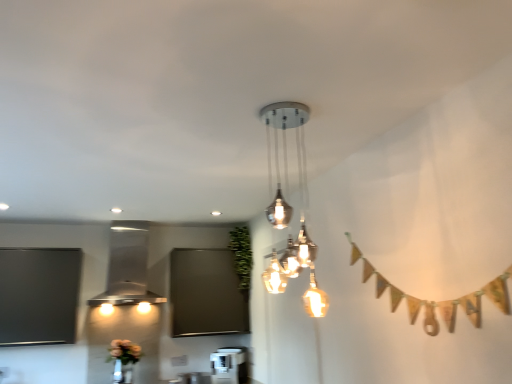
Question: Which direction should I rotate to look at satin silver pendant light at center, the 1th lamp viewed from the right?

Choices:
 (A) right
 (B) left

Answer: (A)

Question: Is matte floral arrangement at lower left positioned before satin silver pendant light at center, marked as the 1th lamp in a front-to-back arrangement?

Choices:
 (A) yes
 (B) no

Answer: (B)

Question: Does matte floral arrangement at lower left have a lesser width compared to satin silver pendant light at center, which is the second lamp in back-to-front order?

Choices:
 (A) no
 (B) yes

Answer: (B)

Question: Is matte floral arrangement at lower left at the left side of satin silver pendant light at center, the 1th lamp viewed from the right?

Choices:
 (A) no
 (B) yes

Answer: (B)

Question: Is matte floral arrangement at lower left aimed at satin silver pendant light at center, marked as the 1th lamp in a front-to-back arrangement?

Choices:
 (A) yes
 (B) no

Answer: (A)

Question: Considering the relative sizes of matte floral arrangement at lower left and satin silver pendant light at center, which appears as the 2th lamp when viewed from the left, in the image provided, is matte floral arrangement at lower left smaller than satin silver pendant light at center, which appears as the 2th lamp when viewed from the left,?

Choices:
 (A) yes
 (B) no

Answer: (A)

Question: From the image's perspective, is matte floral arrangement at lower left under satin silver pendant light at center, which is the second lamp in back-to-front order?

Choices:
 (A) yes
 (B) no

Answer: (A)

Question: Is matte floral arrangement at lower left facing towards green leafy plant at center?

Choices:
 (A) yes
 (B) no

Answer: (B)

Question: Is green leafy plant at center at the back of matte floral arrangement at lower left?

Choices:
 (A) yes
 (B) no

Answer: (B)

Question: Is matte floral arrangement at lower left shorter than green leafy plant at center?

Choices:
 (A) no
 (B) yes

Answer: (B)

Question: Considering the relative positions of matte floral arrangement at lower left and green leafy plant at center in the image provided, is matte floral arrangement at lower left behind green leafy plant at center?

Choices:
 (A) yes
 (B) no

Answer: (B)

Question: Is matte floral arrangement at lower left to the right of green leafy plant at center from the viewer's perspective?

Choices:
 (A) yes
 (B) no

Answer: (B)

Question: Is matte floral arrangement at lower left wider than green leafy plant at center?

Choices:
 (A) yes
 (B) no

Answer: (B)

Question: Considering the relative sizes of satin silver pendant light at center, which appears as the 2th lamp when viewed from the left, and stainless steel range hood at left, marked as the 1th lamp in a left-to-right arrangement, in the image provided, is satin silver pendant light at center, which appears as the 2th lamp when viewed from the left, bigger than stainless steel range hood at left, marked as the 1th lamp in a left-to-right arrangement,?

Choices:
 (A) yes
 (B) no

Answer: (B)